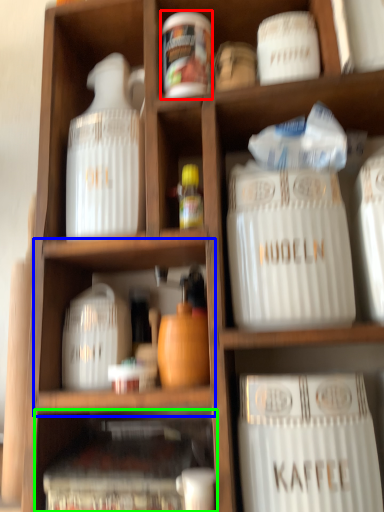
Question: Based on their relative distances, which object is nearer to pottery (highlighted by a red box)? Choose from cabinet (highlighted by a blue box) and cabinet (highlighted by a green box).

Choices:
 (A) cabinet
 (B) cabinet

Answer: (A)